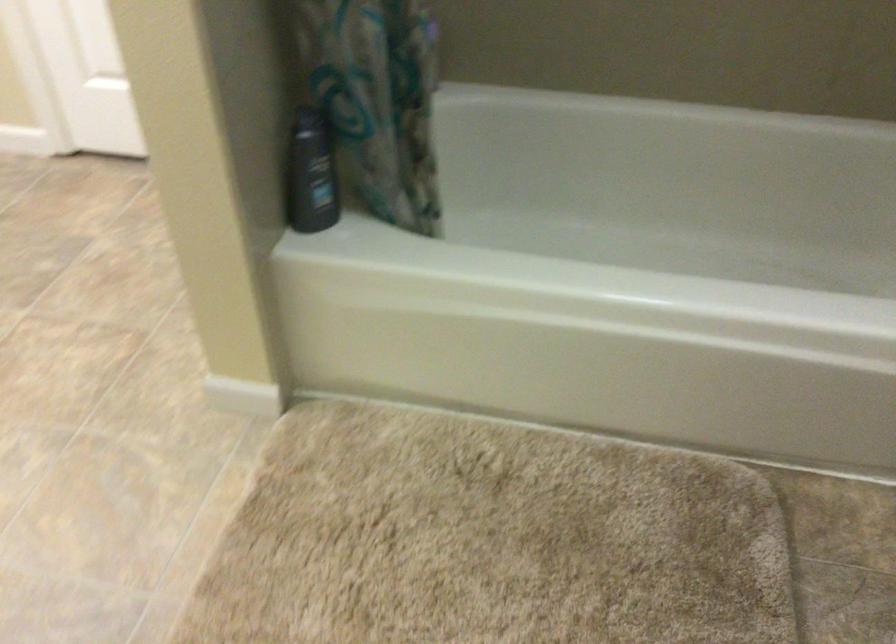
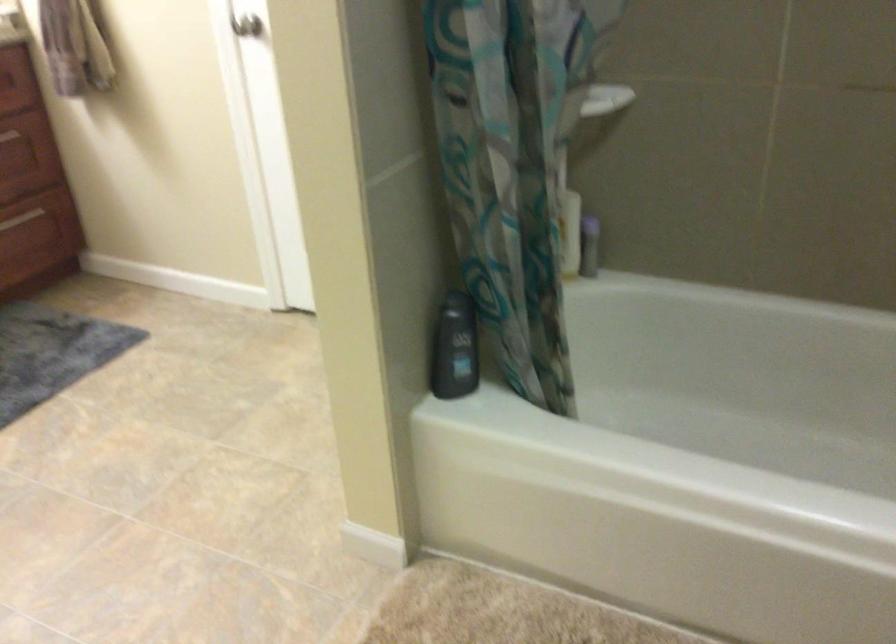
Question: The camera is either moving clockwise (left) or counter-clockwise (right) around the object. The first image is from the beginning of the video and the second image is from the end. Is the camera moving left or right when shooting the video?

Choices:
 (A) Left
 (B) Right

Answer: (B)